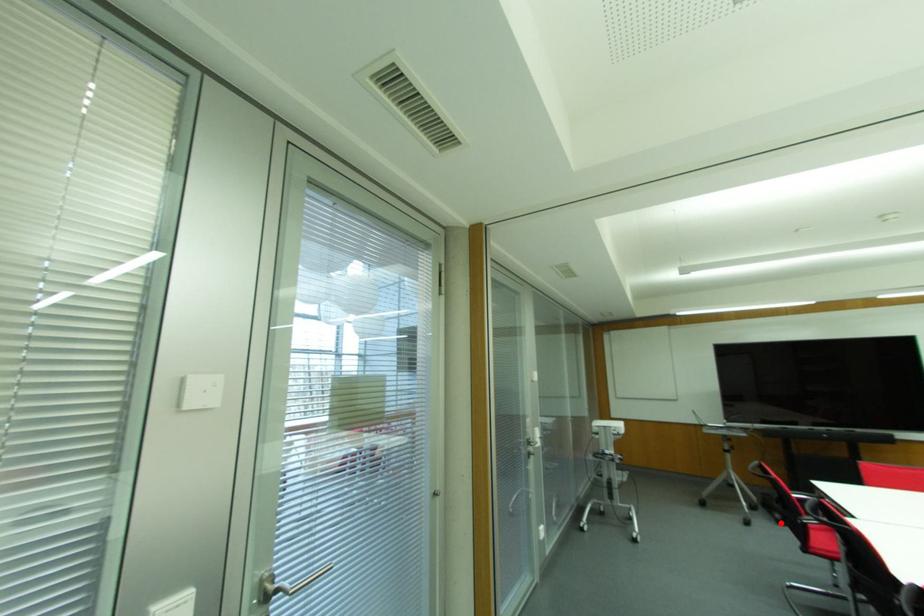
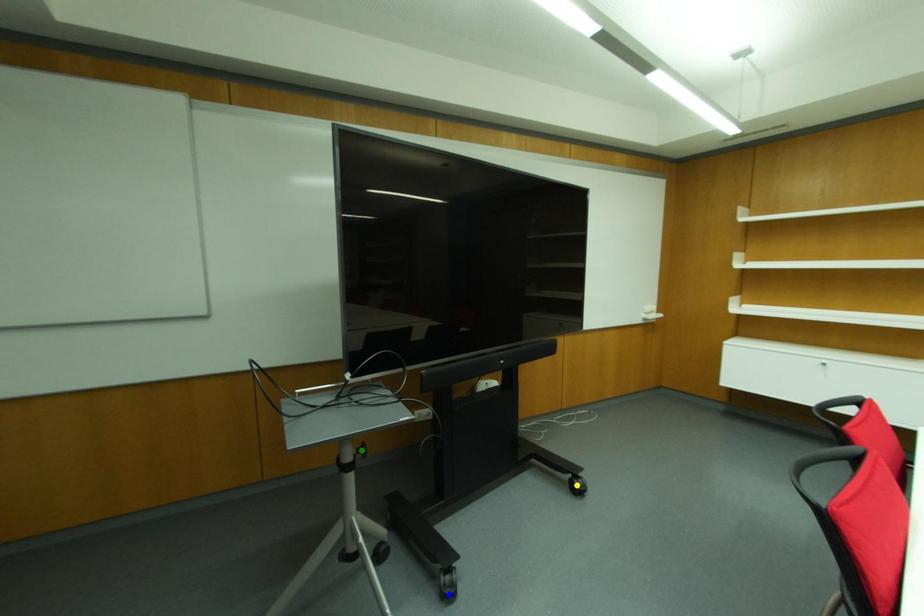
Question: I am providing you with two images of the same scene from different viewpoints. A red point is marked on the first image. You are given multiple points on the second image. Can you choose the point in image 2 that corresponds to the point in image 1?

Choices:
 (A) green point
 (B) blue point
 (C) yellow point

Answer: (B)